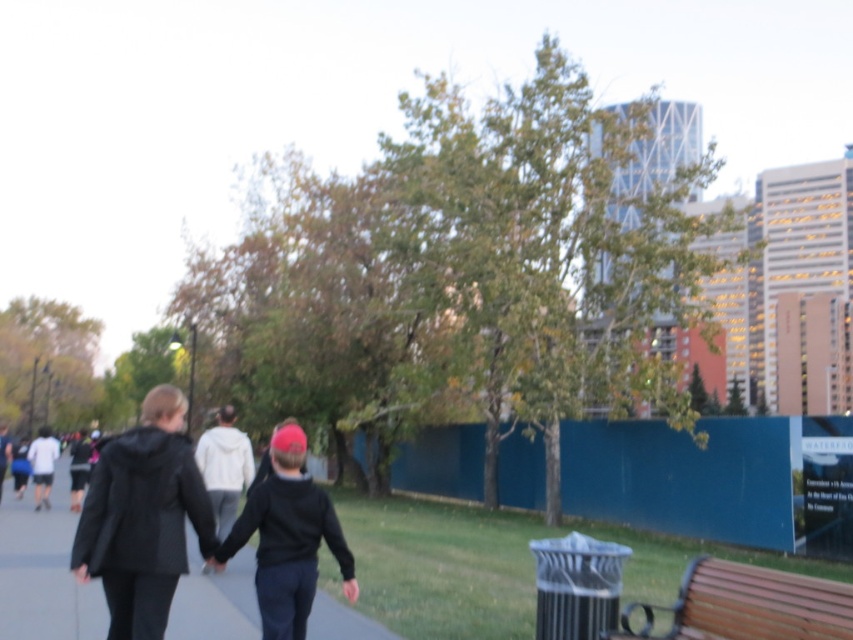
Question: From the image, what is the correct spatial relationship of black hoodie at center in relation to black matte jacket at center?

Choices:
 (A) above
 (B) below

Answer: (B)

Question: Which of the following is the closest to the observer?

Choices:
 (A) white matte shirt at left
 (B) dark gray hoodie at center
 (C) black hoodie at center

Answer: (C)

Question: Which is farther from the brown wooden bench at lower right?

Choices:
 (A) black matte jacket at center
 (B) white matte shirt at left

Answer: (B)

Question: Which point is closer to the camera taking this photo?

Choices:
 (A) (277, 561)
 (B) (160, 509)

Answer: (B)

Question: Is brown wooden bench at lower right wider than dark gray hoodie at center?

Choices:
 (A) no
 (B) yes

Answer: (A)

Question: Is black hoodie at center positioned behind brown wooden bench at lower right?

Choices:
 (A) no
 (B) yes

Answer: (B)